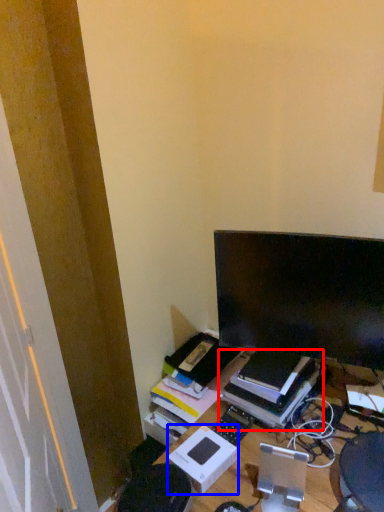
Question: Which of the following is the farthest to the observer, book (highlighted by a red box) or cardboard box (highlighted by a blue box)?

Choices:
 (A) book
 (B) cardboard box

Answer: (A)